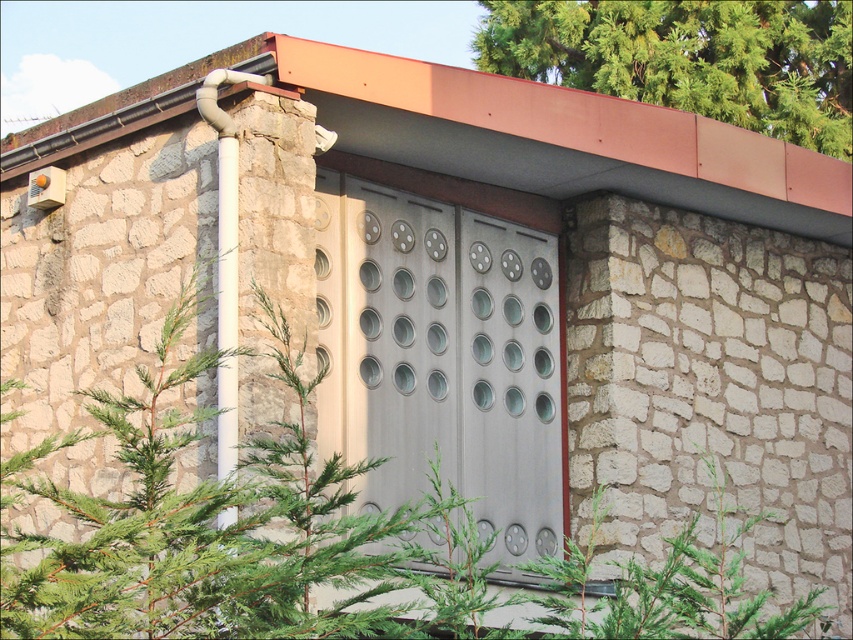
Can you confirm if green leafy tree at center is positioned to the left of green leafy tree at upper right?

Indeed, green leafy tree at center is positioned on the left side of green leafy tree at upper right.

Is green leafy tree at center positioned behind green leafy tree at upper right?

No.

Image resolution: width=853 pixels, height=640 pixels. Identify the location of green leafy tree at center. (712, 392).

You are a GUI agent. You are given a task and a screenshot of the screen. Output one action in this format:
    pyautogui.click(x=<x>, y=<y>)
    Task: Click on the green leafy tree at center
    Image resolution: width=853 pixels, height=640 pixels.
    Given the screenshot: What is the action you would take?
    pyautogui.click(x=712, y=392)